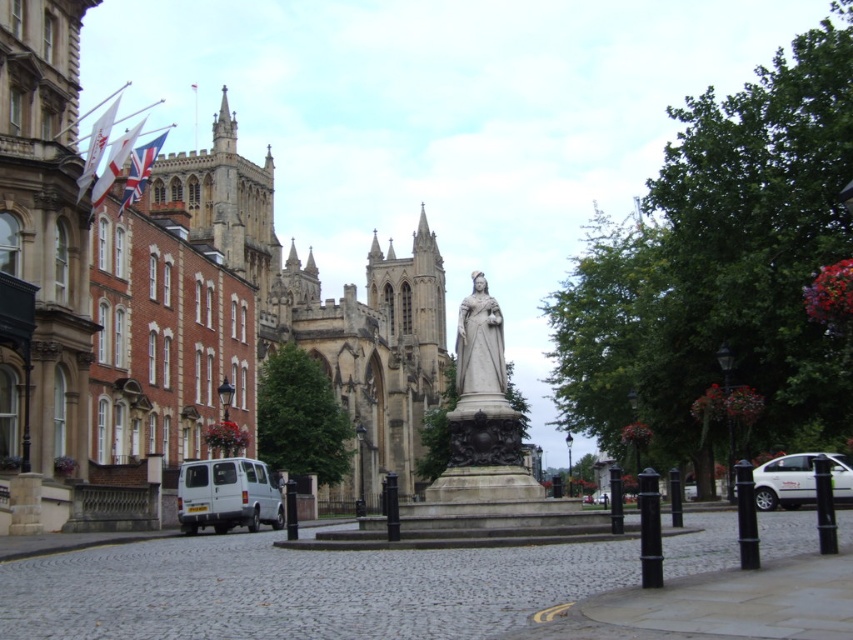
You are a tour guide explaining the landmarks in this square. You mention both the polished bronze statue at center and the white matte car at lower right. Which object is smaller in size?

The polished bronze statue at center is smaller in size compared to the white matte car at lower right.

You are a delivery person who needs to park your vehicle in this square. You have a white matte van at lower left and a white matte car at lower right available. Which vehicle would require less space to park?

The white matte van at lower left occupies less space than the white matte car at lower right, so the van would require less space to park.